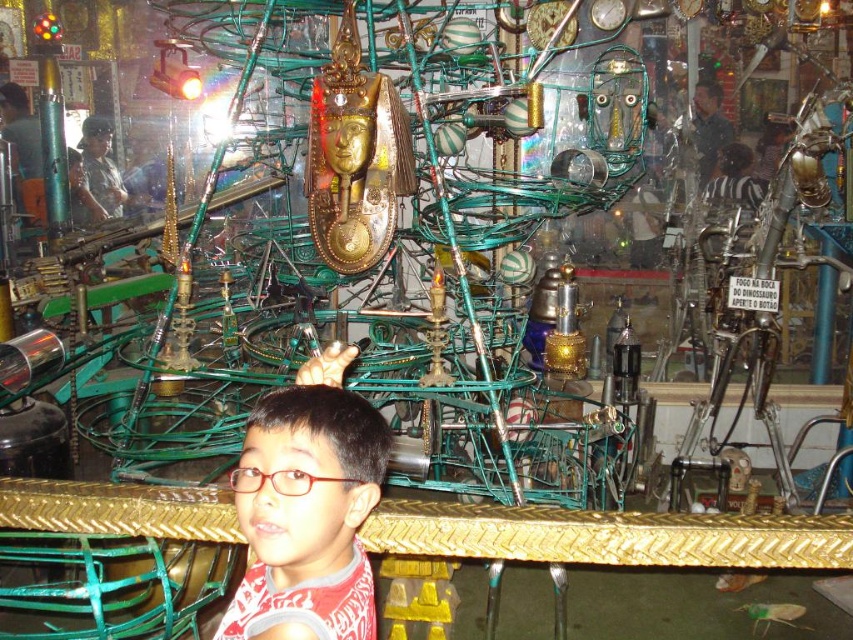
Question: Can you confirm if red matte shirt at center is positioned to the right of red plastic glasses at center?

Choices:
 (A) no
 (B) yes

Answer: (B)

Question: Can you confirm if red matte shirt at center is bigger than red plastic glasses at center?

Choices:
 (A) no
 (B) yes

Answer: (B)

Question: Among these points, which one is farthest from the camera?

Choices:
 (A) (260, 476)
 (B) (312, 573)

Answer: (B)

Question: Where is red matte shirt at center located in relation to red plastic glasses at center in the image?

Choices:
 (A) below
 (B) above

Answer: (A)

Question: Which point is closer to the camera?

Choices:
 (A) (276, 474)
 (B) (287, 532)

Answer: (A)

Question: Which point is farther to the camera?

Choices:
 (A) (280, 470)
 (B) (349, 481)

Answer: (B)